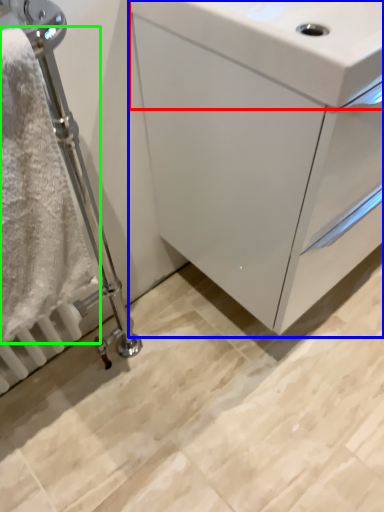
Question: Which object is positioned farthest from sink (highlighted by a red box)? Select from bathroom cabinet (highlighted by a blue box) and bath towel (highlighted by a green box).

Choices:
 (A) bathroom cabinet
 (B) bath towel

Answer: (B)